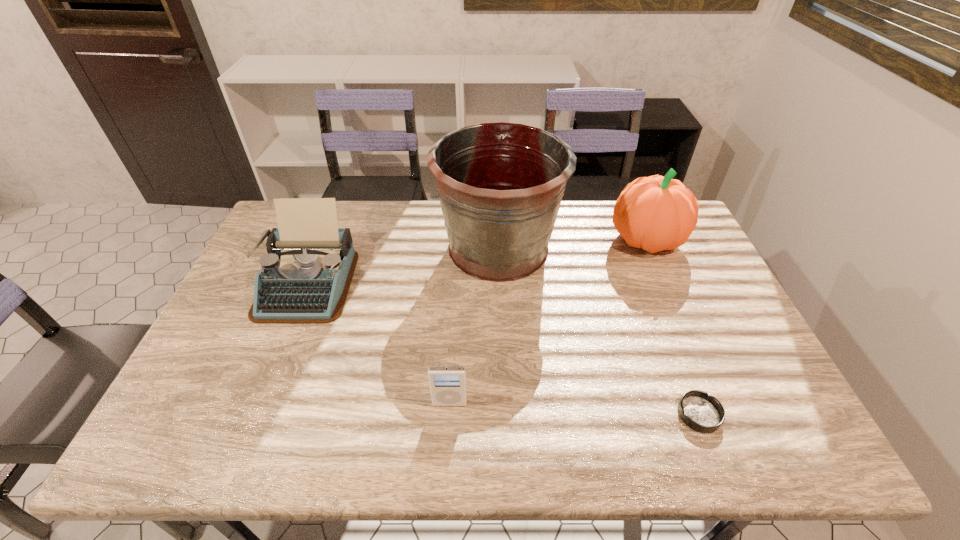
Image resolution: width=960 pixels, height=540 pixels. Identify the location of vacant space that is in between the third shortest object and the fourth tallest object. (378, 343).

Locate an element on the screen. Image resolution: width=960 pixels, height=540 pixels. unoccupied position between the ashtray and the fourth shortest object is located at coordinates (673, 327).

Locate an element on the screen. vacant region between the bucket and the ashtray is located at coordinates (598, 331).

Find the location of a particular element. unoccupied area between the iPod and the bucket is located at coordinates (474, 325).

I want to click on vacant space in between the third tallest object and the bucket, so click(402, 265).

Where is `vacant area that lies between the tallest object and the leftmost object`? vacant area that lies between the tallest object and the leftmost object is located at coordinates (402, 265).

Identify the location of vacant space that's between the pumpkin and the ashtray. The width and height of the screenshot is (960, 540). (673, 327).

I want to click on free space between the fourth tallest object and the bucket, so click(x=474, y=325).

Find the location of a particular element. This screenshot has height=540, width=960. object that is the third closest to the tallest object is located at coordinates (447, 384).

Point out which object is positioned as the third nearest to the fourth shortest object. Please provide its 2D coordinates. Your answer should be formatted as a tuple, i.e. [(x, y)], where the tuple contains the x and y coordinates of a point satisfying the conditions above.

[(447, 384)]